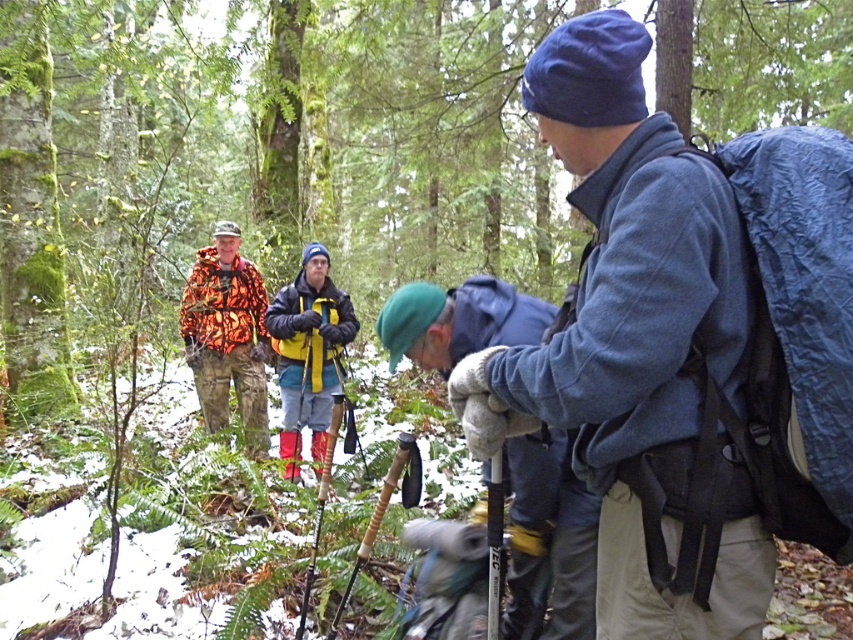
You are planning to join the group in the forest. You see the blue fleece jacket at center and the camouflage fabric jacket at left. Which one is more to the left?

The camouflage fabric jacket at left is more to the left because the blue fleece jacket at center is positioned on the right side of it.